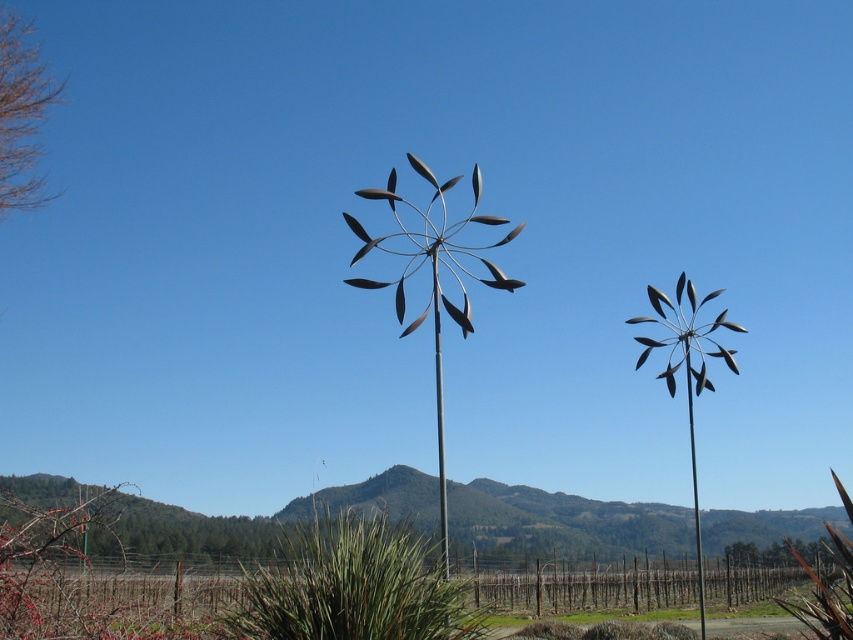
You are an artist planning to paint this rural landscape. You want to ensure the metallic silver windmill at center and the metallic pole at center are proportionally accurate. Which object should you make narrower in your painting?

The metallic silver windmill at center should be made narrower since its width is less than the metallic pole at center.

From the picture: You are a maintenance worker needing to reach both the metallic silver windmill at center and the metallic pole at center. If your ladder is 8 meters long, can you safely reach both objects without moving the ladder?

The distance between the metallic silver windmill at center and the metallic pole at center is 8.71 meters. Since the ladder is only 8 meters long, it is not long enough to span the distance between them. You would need to move the ladder to reach both objects safely.